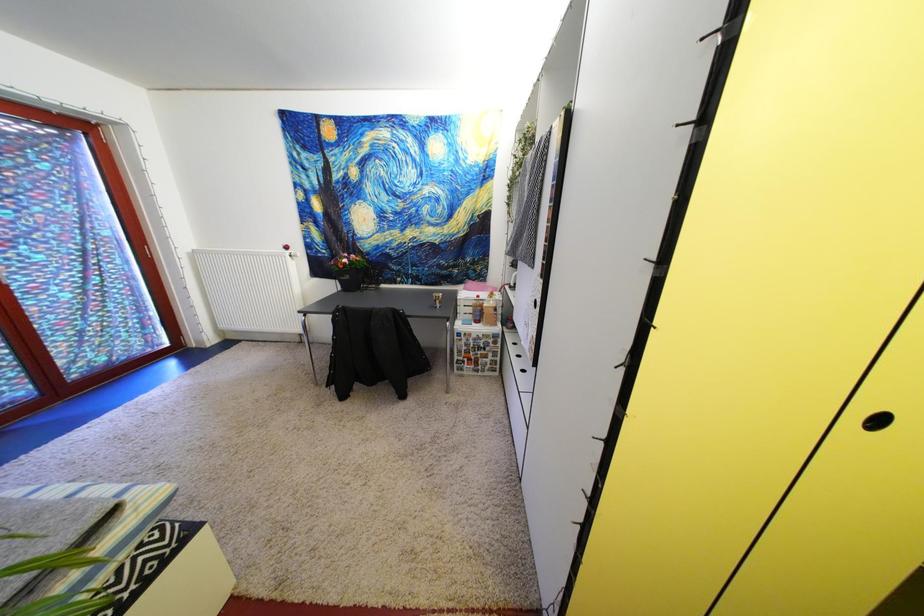
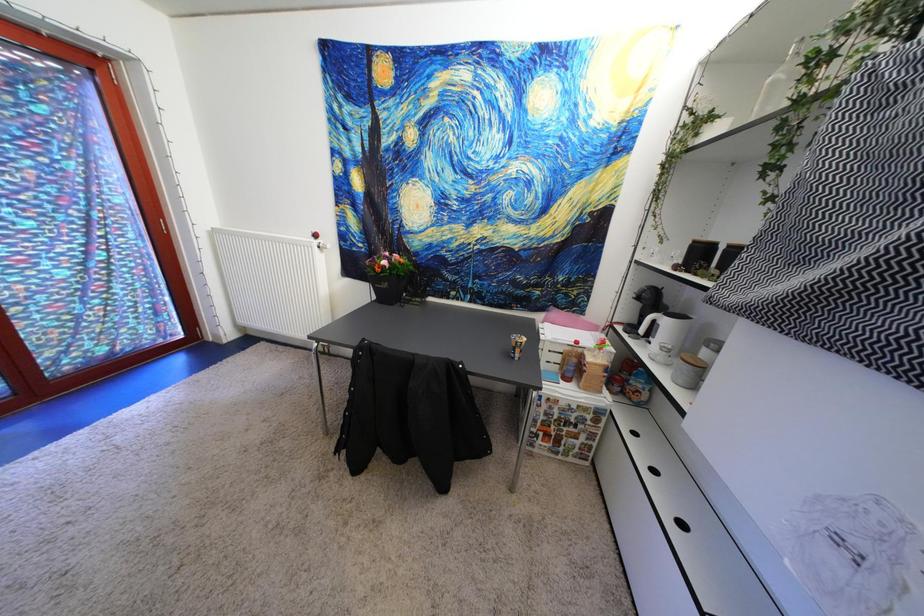
Question: The first image is from the beginning of the video and the second image is from the end. How did the camera likely rotate when shooting the video?

Choices:
 (A) Left
 (B) Right
 (C) Up
 (D) Down

Answer: (A)